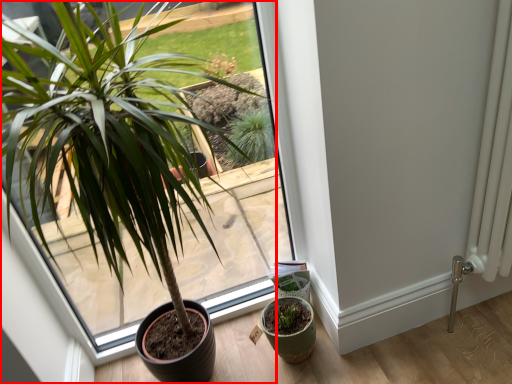
Question: From the image's perspective, what is the correct spatial relationship of houseplant (annotated by the red box) in relation to flowerpot?

Choices:
 (A) above
 (B) below

Answer: (A)